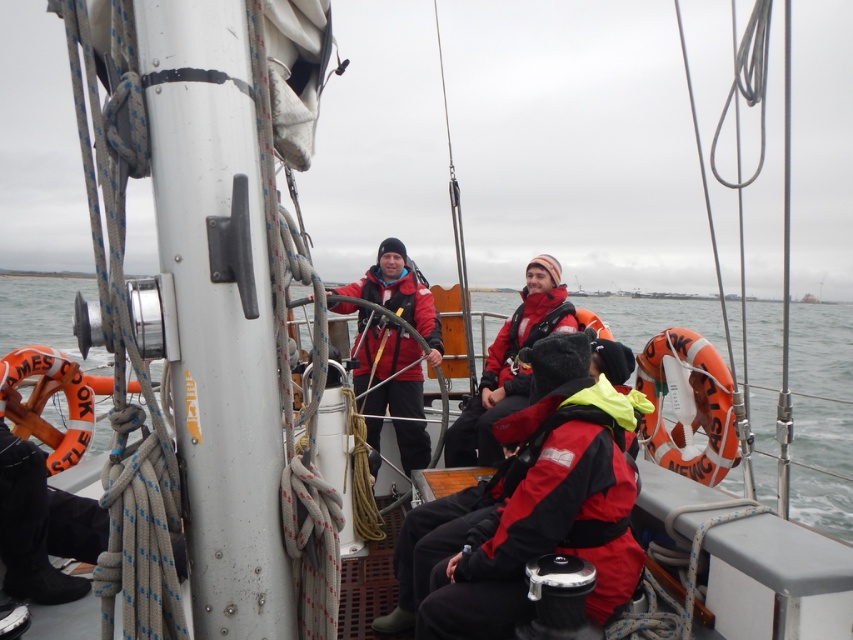
Question: Does red matte life jacket at center have a larger size compared to matte orange life jacket at right?

Choices:
 (A) yes
 (B) no

Answer: (A)

Question: Which object appears closest to the camera in this image?

Choices:
 (A) matte orange life jacket at right
 (B) red matte life jacket at lower center
 (C) matte red life jacket at center
 (D) clear water at center

Answer: (D)

Question: Which object appears closest to the camera in this image?

Choices:
 (A) orange rubber life jacket at right
 (B) red matte life jacket at center
 (C) matte orange life jacket at right

Answer: (A)

Question: Estimate the real-world distances between objects in this image. Which object is farther from the matte orange life jacket at right?

Choices:
 (A) red matte life jacket at lower center
 (B) orange rubber life jacket at right
 (C) orange rubber life jacket at left
 (D) matte red jacket at center

Answer: (C)

Question: Does matte red jacket at center appear over matte red life jacket at center?

Choices:
 (A) no
 (B) yes

Answer: (A)

Question: Is red matte life jacket at lower center behind red matte life jacket at center?

Choices:
 (A) no
 (B) yes

Answer: (A)